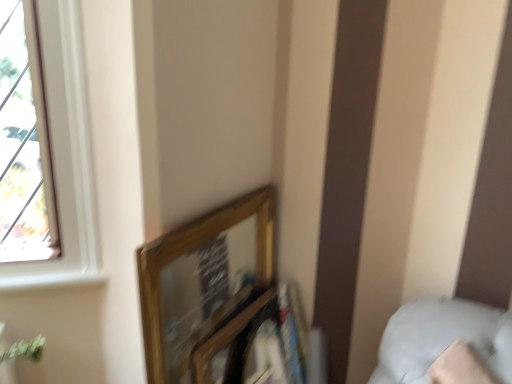
What is the approximate width of white soft pillow at lower right?

It is 43.52 centimeters.

Measure the distance between white soft pillow at lower right and camera.

A distance of 3.90 feet exists between white soft pillow at lower right and camera.

The width and height of the screenshot is (512, 384). Identify the location of white soft pillow at lower right. (442, 338).

What do you see at coordinates (442, 338) in the screenshot? I see `white soft pillow at lower right` at bounding box center [442, 338].

The image size is (512, 384). What do you see at coordinates (256, 341) in the screenshot?
I see `wooden frame at upper center` at bounding box center [256, 341].

This screenshot has height=384, width=512. Find the location of `wooden frame at upper center`. wooden frame at upper center is located at coordinates (256, 341).

Locate an element on the screen. This screenshot has height=384, width=512. white soft pillow at lower right is located at coordinates (442, 338).

Can you confirm if white soft pillow at lower right is positioned to the left of wooden frame at upper center?

No, white soft pillow at lower right is not to the left of wooden frame at upper center.

Is white soft pillow at lower right positioned in front of wooden frame at upper center?

Yes, the depth of white soft pillow at lower right is less than that of wooden frame at upper center.

Does point (496, 347) come farther from viewer compared to point (272, 288)?

No.

From the image's perspective, would you say white soft pillow at lower right is positioned over wooden frame at upper center?

Correct, white soft pillow at lower right appears higher than wooden frame at upper center in the image.

From a real-world perspective, is white soft pillow at lower right above or below wooden frame at upper center?

white soft pillow at lower right is above wooden frame at upper center.

In terms of width, does white soft pillow at lower right look wider or thinner when compared to wooden frame at upper center?

Clearly, white soft pillow at lower right has more width compared to wooden frame at upper center.

Based on the photo, which of these two, white soft pillow at lower right or wooden frame at upper center, stands taller?

With more height is wooden frame at upper center.

Is white soft pillow at lower right bigger or smaller than wooden frame at upper center?

Considering their sizes, white soft pillow at lower right takes up more space than wooden frame at upper center.

Choose the correct answer: Is white soft pillow at lower right inside wooden frame at upper center or outside it?

The correct answer is: outside.

Are white soft pillow at lower right and wooden frame at upper center making contact?

white soft pillow at lower right is not next to wooden frame at upper center, and they're not touching.

Is wooden frame at upper center at the back of white soft pillow at lower right?

No, white soft pillow at lower right's orientation is not away from wooden frame at upper center.

How many degrees apart are the facing directions of white soft pillow at lower right and wooden frame at upper center?

60.9 degrees.

The image size is (512, 384). I want to click on pillow lying above the wooden frame at upper center (from the image's perspective), so click(x=442, y=338).

Between wooden frame at upper center and white soft pillow at lower right, which one appears on the left side from the viewer's perspective?

From the viewer's perspective, wooden frame at upper center appears more on the left side.

Relative to white soft pillow at lower right, is wooden frame at upper center in front or behind?

Clearly, wooden frame at upper center is behind white soft pillow at lower right.

Is point (272, 344) more distant than point (439, 345)?

Yes, it is.

From the image's perspective, would you say wooden frame at upper center is positioned over white soft pillow at lower right?

No, from the image's perspective, wooden frame at upper center is not above white soft pillow at lower right.

From a real-world perspective, is wooden frame at upper center over white soft pillow at lower right?

No, from a real-world perspective, wooden frame at upper center is not on top of white soft pillow at lower right.

Does wooden frame at upper center have a lesser width compared to white soft pillow at lower right?

Yes.

Can you confirm if wooden frame at upper center is taller than white soft pillow at lower right?

Correct, wooden frame at upper center is much taller as white soft pillow at lower right.

Considering the sizes of wooden frame at upper center and white soft pillow at lower right in the image, is wooden frame at upper center bigger or smaller than white soft pillow at lower right?

wooden frame at upper center is smaller than white soft pillow at lower right.

Can we say wooden frame at upper center lies outside white soft pillow at lower right?

Yes, wooden frame at upper center is located beyond the bounds of white soft pillow at lower right.

Is wooden frame at upper center far away from white soft pillow at lower right?

They are positioned close to each other.

Is wooden frame at upper center oriented towards white soft pillow at lower right?

Yes, wooden frame at upper center faces towards white soft pillow at lower right.

Identify the location of shelf on the left of white soft pillow at lower right. The image size is (512, 384). (256, 341).

The width and height of the screenshot is (512, 384). Identify the location of shelf directly beneath the white soft pillow at lower right (from a real-world perspective). [x=256, y=341].

What are the coordinates of `pillow located in front of the wooden frame at upper center` in the screenshot? It's located at (442, 338).